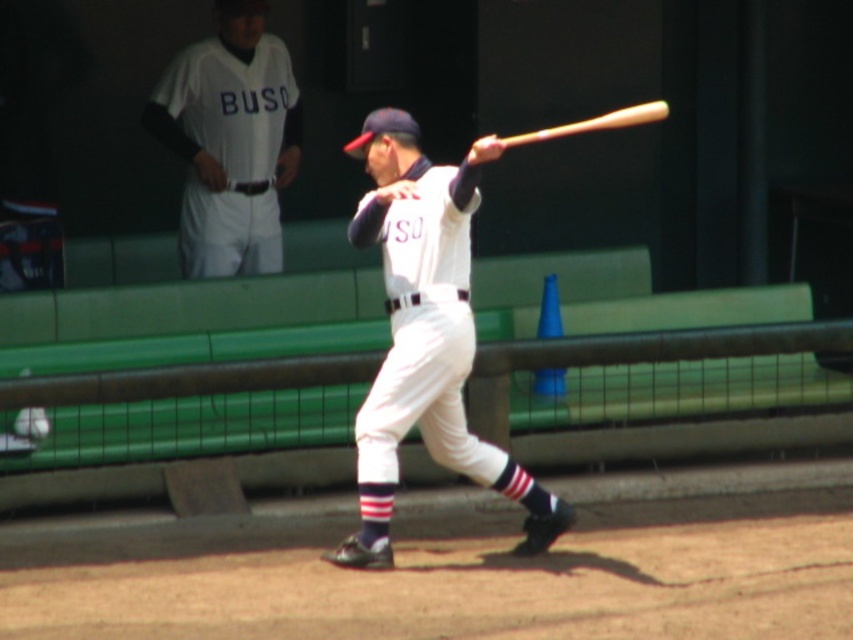
Question: Is white matte baseball bat at center wider than white matte uniform at upper center?

Choices:
 (A) yes
 (B) no

Answer: (A)

Question: Based on their relative distances, which object is nearer to the white matte uniform at upper center?

Choices:
 (A) white matte baseball bat at center
 (B) wooden baseball bat at center

Answer: (A)

Question: Considering the real-world distances, which object is farthest from the white matte uniform at upper center?

Choices:
 (A) white matte baseball bat at center
 (B) wooden baseball bat at center

Answer: (B)

Question: Can you confirm if white matte uniform at upper center is bigger than wooden baseball bat at center?

Choices:
 (A) yes
 (B) no

Answer: (A)

Question: Which of the following is the closest to the observer?

Choices:
 (A) [x=430, y=204]
 (B) [x=643, y=109]
 (C) [x=158, y=92]

Answer: (B)

Question: Does white matte baseball bat at center come behind white matte uniform at upper center?

Choices:
 (A) yes
 (B) no

Answer: (B)